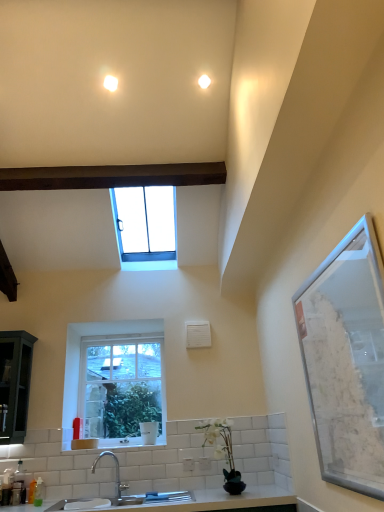
The image size is (384, 512). I want to click on clear glass window screen at right, so click(x=346, y=360).

The image size is (384, 512). Describe the element at coordinates (221, 445) in the screenshot. I see `white matte vase at lower center` at that location.

Find the location of a particular element. The image size is (384, 512). clear glass window at upper center, placed as the 1th window when sorted from top to bottom is located at coordinates (145, 227).

At what (x,y) coordinates should I click in order to perform the action: click on clear glass window screen at right. Please return your answer as a coordinate pair (x, y). This screenshot has height=512, width=384. Looking at the image, I should click on (346, 360).

Are white matte vase at lower center and clear glass window at center, the 1th window in the bottom-to-top sequence, far apart?

white matte vase at lower center is positioned a significant distance from clear glass window at center, the 1th window in the bottom-to-top sequence.

Between point (225, 420) and point (102, 432), which one is positioned in front?

Point (225, 420)

Where is `plant below the clear glass window at center, which is the 2th window in top-to-bottom order (from the image's perspective)`? The image size is (384, 512). plant below the clear glass window at center, which is the 2th window in top-to-bottom order (from the image's perspective) is located at coordinates (221, 445).

From a real-world perspective, is clear glass window at upper center, marked as the 2th window in a bottom-to-top arrangement, physically located above or below clear glass window screen at right?

In terms of real-world spatial position, clear glass window at upper center, marked as the 2th window in a bottom-to-top arrangement, is above clear glass window screen at right.

Is clear glass window at upper center, marked as the 2th window in a bottom-to-top arrangement, facing away from clear glass window screen at right?

No, clear glass window at upper center, marked as the 2th window in a bottom-to-top arrangement, is not facing away from clear glass window screen at right.

Is clear glass window at upper center, marked as the 2th window in a bottom-to-top arrangement, completely or partially outside of clear glass window screen at right?

Indeed, clear glass window at upper center, marked as the 2th window in a bottom-to-top arrangement, is completely outside clear glass window screen at right.

Is clear glass window at upper center, placed as the 1th window when sorted from top to bottom, bigger or smaller than white matte vase at lower center?

In the image, clear glass window at upper center, placed as the 1th window when sorted from top to bottom, appears to be larger than white matte vase at lower center.

Considering their positions, is clear glass window at upper center, marked as the 2th window in a bottom-to-top arrangement, located in front of or behind white matte vase at lower center?

Clearly, clear glass window at upper center, marked as the 2th window in a bottom-to-top arrangement, is behind white matte vase at lower center.

Can you confirm if clear glass window at upper center, marked as the 2th window in a bottom-to-top arrangement, is thinner than white matte vase at lower center?

In fact, clear glass window at upper center, marked as the 2th window in a bottom-to-top arrangement, might be wider than white matte vase at lower center.

Is point (150, 243) closer or farther from the camera than point (197, 426)?

Point (150, 243).

Between white matte vase at lower center and clear glass window at upper center, placed as the 1th window when sorted from top to bottom, which one has more height?

Standing taller between the two is clear glass window at upper center, placed as the 1th window when sorted from top to bottom.

What's the angular difference between white matte vase at lower center and clear glass window at upper center, placed as the 1th window when sorted from top to bottom,'s facing directions?

39.5 degrees separate the facing orientations of white matte vase at lower center and clear glass window at upper center, placed as the 1th window when sorted from top to bottom.

In order to click on plant below the clear glass window at upper center, marked as the 2th window in a bottom-to-top arrangement (from the image's perspective) in this screenshot , I will do `click(221, 445)`.

Considering the positions of point (205, 434) and point (141, 260), is point (205, 434) closer or farther from the camera than point (141, 260)?

Point (205, 434).

From the image's perspective, would you say clear glass window screen at right is positioned over clear glass window at upper center, marked as the 2th window in a bottom-to-top arrangement?

No, from the image's perspective, clear glass window screen at right is not on top of clear glass window at upper center, marked as the 2th window in a bottom-to-top arrangement.

Is clear glass window screen at right positioned beyond the bounds of clear glass window at upper center, marked as the 2th window in a bottom-to-top arrangement?

clear glass window screen at right is positioned outside clear glass window at upper center, marked as the 2th window in a bottom-to-top arrangement.

Which object is positioned more to the left, clear glass window screen at right or clear glass window at upper center, placed as the 1th window when sorted from top to bottom?

From the viewer's perspective, clear glass window at upper center, placed as the 1th window when sorted from top to bottom, appears more on the left side.

In terms of width, does white matte vase at lower center look wider or thinner when compared to white ceramic sink at lower center?

In the image, white matte vase at lower center appears to be more narrow than white ceramic sink at lower center.

Image resolution: width=384 pixels, height=512 pixels. I want to click on plant lying above the white ceramic sink at lower center (from the image's perspective), so click(x=221, y=445).

Can you confirm if white matte vase at lower center is positioned to the right of white ceramic sink at lower center?

Indeed, white matte vase at lower center is positioned on the right side of white ceramic sink at lower center.

From the image's perspective, is white matte vase at lower center positioned above or below white ceramic sink at lower center?

Clearly, from the image's perspective, white matte vase at lower center is above white ceramic sink at lower center.

Is clear glass window at center, which is the 2th window in top-to-bottom order, turned away from clear glass window at upper center, marked as the 2th window in a bottom-to-top arrangement?

That's not correct — clear glass window at center, which is the 2th window in top-to-bottom order, is not looking away from clear glass window at upper center, marked as the 2th window in a bottom-to-top arrangement.

Does clear glass window at center, the 1th window in the bottom-to-top sequence, touch clear glass window at upper center, marked as the 2th window in a bottom-to-top arrangement?

There is a gap between clear glass window at center, the 1th window in the bottom-to-top sequence, and clear glass window at upper center, marked as the 2th window in a bottom-to-top arrangement.

Is clear glass window at center, which is the 2th window in top-to-bottom order, to the right of clear glass window at upper center, placed as the 1th window when sorted from top to bottom, from the viewer's perspective?

No, clear glass window at center, which is the 2th window in top-to-bottom order, is not to the right of clear glass window at upper center, placed as the 1th window when sorted from top to bottom.

Considering the relative sizes of clear glass window at center, which is the 2th window in top-to-bottom order, and clear glass window at upper center, placed as the 1th window when sorted from top to bottom, in the image provided, is clear glass window at center, which is the 2th window in top-to-bottom order, shorter than clear glass window at upper center, placed as the 1th window when sorted from top to bottom,?

Incorrect, the height of clear glass window at center, which is the 2th window in top-to-bottom order, does not fall short of that of clear glass window at upper center, placed as the 1th window when sorted from top to bottom.

You are a GUI agent. You are given a task and a screenshot of the screen. Output one action in this format:
    pyautogui.click(x=<x>, y=<y>)
    Task: Click on the plant below the clear glass window at center, which is the 2th window in top-to-bottom order (from a real-world perspective)
    The height and width of the screenshot is (512, 384).
    Given the screenshot: What is the action you would take?
    pyautogui.click(x=221, y=445)

Identify the location of window screen on the right of clear glass window at upper center, marked as the 2th window in a bottom-to-top arrangement. (346, 360).

When comparing their distances from clear glass window screen at right, does white ceramic sink at lower center or clear glass window at center, the 1th window in the bottom-to-top sequence, seem closer?

The object closer to clear glass window screen at right is white ceramic sink at lower center.

Estimate the real-world distances between objects in this image. Which object is further from clear glass window at center, the 1th window in the bottom-to-top sequence, white ceramic sink at lower center or white matte vase at lower center?

white matte vase at lower center lies further to clear glass window at center, the 1th window in the bottom-to-top sequence, than the other object.

When comparing their distances from white matte vase at lower center, does white ceramic sink at lower center or clear glass window at center, which is the 2th window in top-to-bottom order, seem closer?

white ceramic sink at lower center lies closer to white matte vase at lower center than the other object.

Estimate the real-world distances between objects in this image. Which object is further from white ceramic sink at lower center, clear glass window at upper center, placed as the 1th window when sorted from top to bottom, or white matte vase at lower center?

The object further to white ceramic sink at lower center is clear glass window at upper center, placed as the 1th window when sorted from top to bottom.

Which object lies nearer to the anchor point satin nickel faucet at lower center, white ceramic sink at lower center or white matte vase at lower center?

white ceramic sink at lower center is closer to satin nickel faucet at lower center.

Looking at the image, which one is located closer to clear glass window at upper center, placed as the 1th window when sorted from top to bottom, white matte vase at lower center or white ceramic sink at lower center?

white ceramic sink at lower center.

Based on their spatial positions, is white matte vase at lower center or clear glass window at center, the 1th window in the bottom-to-top sequence, further from clear glass window screen at right?

The object further to clear glass window screen at right is clear glass window at center, the 1th window in the bottom-to-top sequence.

Based on their spatial positions, is clear glass window at center, which is the 2th window in top-to-bottom order, or satin nickel faucet at lower center closer to white matte vase at lower center?

Among the two, satin nickel faucet at lower center is located nearer to white matte vase at lower center.

Identify the location of window between clear glass window at upper center, placed as the 1th window when sorted from top to bottom, and white ceramic sink at lower center in the up-down direction. (115, 381).

In order to click on plant between clear glass window screen at right and clear glass window at center, the 1th window in the bottom-to-top sequence, along the z-axis in this screenshot , I will do (221, 445).

At what (x,y) coordinates should I click in order to perform the action: click on sink between clear glass window screen at right and clear glass window at upper center, marked as the 2th window in a bottom-to-top arrangement, in the front-back direction. Please return your answer as a coordinate pair (x, y). The width and height of the screenshot is (384, 512). Looking at the image, I should click on (121, 493).

Locate an element on the screen. Image resolution: width=384 pixels, height=512 pixels. plant positioned between satin nickel faucet at lower center and clear glass window at center, the 1th window in the bottom-to-top sequence, from near to far is located at coordinates (221, 445).